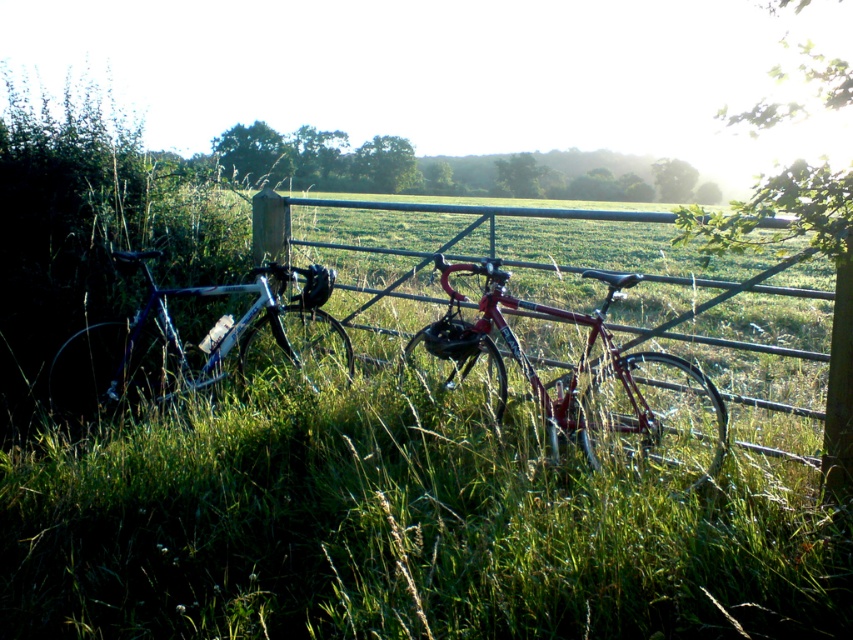
You are standing in the middle of the field and see the point marked at coordinates point (x=199, y=340). What object is located at that point?

The point (x=199, y=340) indicates the location of the shiny silver bicycle at left.

In the scene shown: You are a painter standing between the shiny metallic bicycle at center and the shiny silver bicycle at left. You want to paint both bicycles but can only reach 1.2 meters with your brush. Can you paint both bicycles without moving closer?

The distance between the shiny metallic bicycle at center and the shiny silver bicycle at left is 1.34 meters. Since your brush can only reach 1.2 meters, you cannot paint both bicycles without moving closer.

You are standing at the metal gate in the field and see two points marked in the image. Which point is closer to you, point (590, 420) or point (149, 390)?

Point (590, 420) is in front of point (149, 390), so it is closer to you.